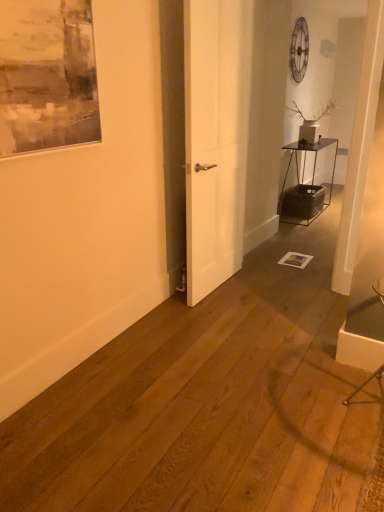
Where is `vacant area located to the right-hand side of white matte door at center`? This screenshot has width=384, height=512. vacant area located to the right-hand side of white matte door at center is located at coordinates (261, 284).